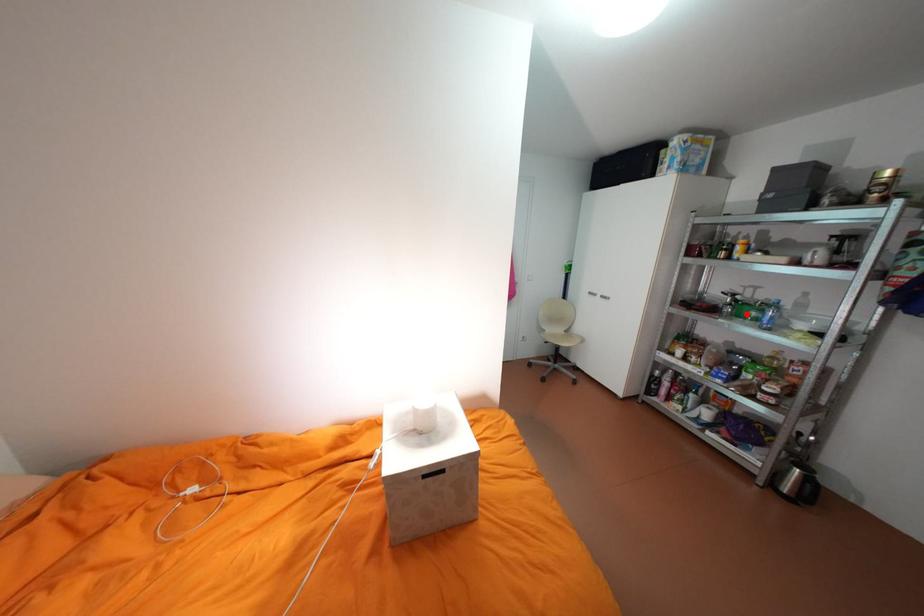
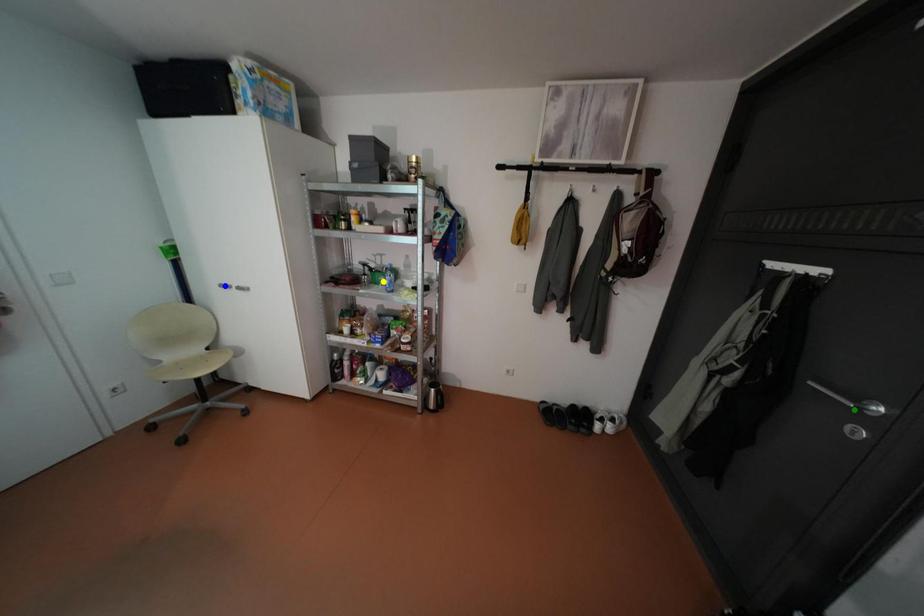
Question: I am providing you with two images of the same scene from different viewpoints. A red point is marked on the first image. You are given multiple points on the second image. Which point in image 2 represents the same 3d spot as the red point in image 1?

Choices:
 (A) blue point
 (B) green point
 (C) yellow point

Answer: (C)